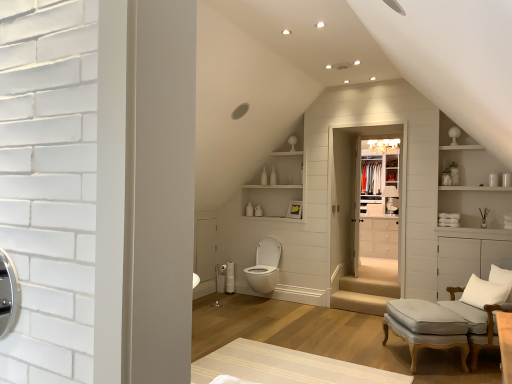
Question: Considering their positions, is matte white lampshade at center located in front of or behind clear glass closet door at center?

Choices:
 (A) front
 (B) behind

Answer: (B)

Question: In terms of size, does matte white lampshade at center appear bigger or smaller than clear glass closet door at center?

Choices:
 (A) small
 (B) big

Answer: (A)

Question: Estimate the real-world distances between objects in this image. Which object is closer to the white glossy cabinet at center?

Choices:
 (A) white glossy toilet at center
 (B) white glossy medicine cabinet at center
 (C) white soft cushion at lower right
 (D) light gray fabric stool at lower right
 (E) beige striped rug at center

Answer: (B)

Question: Based on their relative distances, which object is farther from the white glossy cabinet at center?

Choices:
 (A) white glossy cabinet at upper right
 (B) white matte shelves at upper center
 (C) clear glass closet door at center
 (D) light gray fabric chair at lower right
 (E) white glossy medicine cabinet at center

Answer: (D)